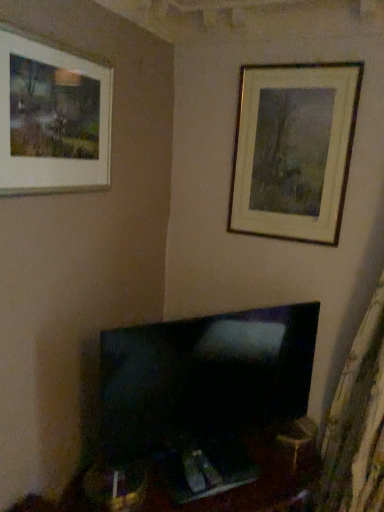
Question: Considering the relative positions of gold metallic picture frame at upper right, which is the second picture frame in front-to-back order, and matte white picture frame at upper left, positioned as the 1th picture frame in front-to-back order, in the image provided, is gold metallic picture frame at upper right, which is the second picture frame in front-to-back order, to the right of matte white picture frame at upper left, positioned as the 1th picture frame in front-to-back order, from the viewer's perspective?

Choices:
 (A) no
 (B) yes

Answer: (B)

Question: Is gold metallic picture frame at upper right, which is the second picture frame in front-to-back order, wider than matte white picture frame at upper left, which ranks as the 1th picture frame in left-to-right order?

Choices:
 (A) no
 (B) yes

Answer: (A)

Question: Is gold metallic picture frame at upper right, marked as the first picture frame in a back-to-front arrangement, in contact with matte white picture frame at upper left, positioned as the 1th picture frame in front-to-back order?

Choices:
 (A) no
 (B) yes

Answer: (A)

Question: Is gold metallic picture frame at upper right, which is the second picture frame in front-to-back order, positioned before matte white picture frame at upper left, placed as the second picture frame when sorted from back to front?

Choices:
 (A) yes
 (B) no

Answer: (B)

Question: Is gold metallic picture frame at upper right, which ranks as the 1th picture frame in right-to-left order, taller than matte white picture frame at upper left, placed as the second picture frame when sorted from back to front?

Choices:
 (A) yes
 (B) no

Answer: (A)

Question: Considering their positions, is black glossy tv at center located in front of or behind gold metallic picture frame at upper right, the 2th picture frame from the left?

Choices:
 (A) front
 (B) behind

Answer: (A)

Question: In terms of size, does black glossy tv at center appear bigger or smaller than gold metallic picture frame at upper right, which ranks as the 1th picture frame in right-to-left order?

Choices:
 (A) big
 (B) small

Answer: (A)

Question: Is black glossy tv at center inside the boundaries of gold metallic picture frame at upper right, which ranks as the 1th picture frame in right-to-left order, or outside?

Choices:
 (A) inside
 (B) outside

Answer: (B)

Question: Is point click(x=155, y=421) positioned closer to the camera than point click(x=334, y=161)?

Choices:
 (A) closer
 (B) farther

Answer: (A)

Question: Is point pyautogui.click(x=299, y=142) closer or farther from the camera than point pyautogui.click(x=299, y=340)?

Choices:
 (A) farther
 (B) closer

Answer: (B)

Question: Is gold metallic picture frame at upper right, which is the second picture frame in front-to-back order, in front of or behind black glossy tv at center in the image?

Choices:
 (A) front
 (B) behind

Answer: (B)

Question: In terms of size, does gold metallic picture frame at upper right, the 2th picture frame from the left, appear bigger or smaller than black glossy tv at center?

Choices:
 (A) small
 (B) big

Answer: (A)

Question: Based on their positions, is gold metallic picture frame at upper right, the 2th picture frame from the left, located to the left or right of black glossy tv at center?

Choices:
 (A) right
 (B) left

Answer: (A)

Question: Is gold metallic picture frame at upper right, marked as the first picture frame in a back-to-front arrangement, taller or shorter than matte white picture frame at upper left, positioned as the 1th picture frame in front-to-back order?

Choices:
 (A) short
 (B) tall

Answer: (B)

Question: Would you say gold metallic picture frame at upper right, which is the second picture frame in front-to-back order, is to the left or to the right of matte white picture frame at upper left, which is the second picture frame in right-to-left order, in the picture?

Choices:
 (A) right
 (B) left

Answer: (A)